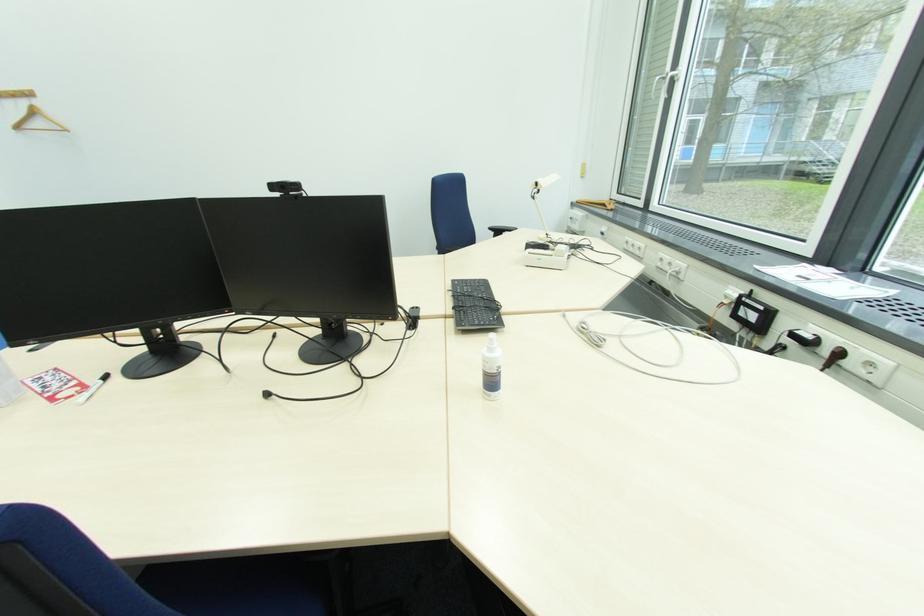
In order to click on telephone handset in this screenshot , I will do `click(546, 254)`.